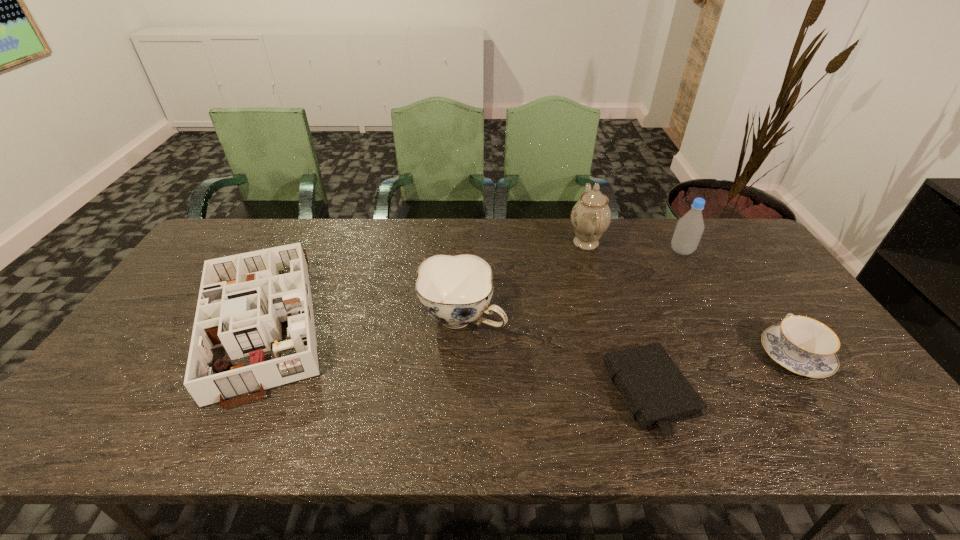
I want to click on the second chinaware from left to right, so click(x=591, y=216).

Locate an element on the screen. the tallest chinaware is located at coordinates (591, 216).

You are a GUI agent. You are given a task and a screenshot of the screen. Output one action in this format:
    pyautogui.click(x=<x>, y=<y>)
    Task: Click on the bottle
    The width and height of the screenshot is (960, 540).
    Given the screenshot: What is the action you would take?
    pyautogui.click(x=689, y=229)

Image resolution: width=960 pixels, height=540 pixels. In order to click on the fourth shortest object in this screenshot , I will do `click(455, 290)`.

This screenshot has width=960, height=540. Identify the location of the leftmost chinaware. (455, 290).

Find the location of a particular element. This screenshot has width=960, height=540. the leftmost object is located at coordinates (243, 300).

Where is `the rightmost chinaware`? the rightmost chinaware is located at coordinates (802, 345).

You are a GUI agent. You are given a task and a screenshot of the screen. Output one action in this format:
    pyautogui.click(x=<x>, y=<y>)
    Task: Click on the rightmost object
    The image size is (960, 540).
    Given the screenshot: What is the action you would take?
    pyautogui.click(x=802, y=345)

The width and height of the screenshot is (960, 540). I want to click on Bible, so click(x=658, y=394).

Locate an element on the screen. blank space located on the spout of the farthest chinaware is located at coordinates (482, 242).